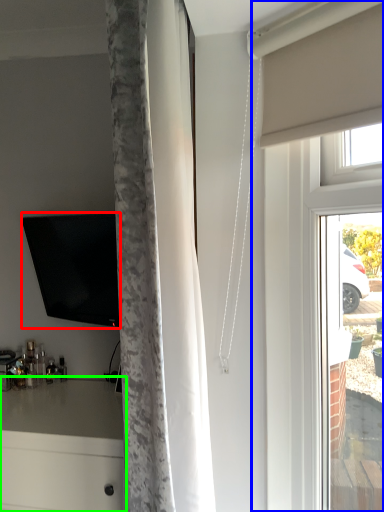
Question: Which object is positioned farthest from television (highlighted by a red box)? Select from glass door (highlighted by a blue box) and counter (highlighted by a green box).

Choices:
 (A) glass door
 (B) counter

Answer: (A)